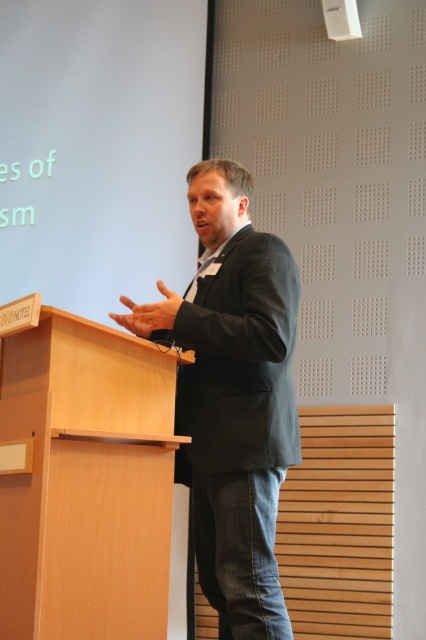
You are standing at the back of the room and want to approach the light wood podium at left to ask a question. If your walking speed is 3 feet per second, how many seconds will it take you to reach the podium?

The light wood podium at left is 7.29 feet away from the camera. Since you are at the back of the room, the distance to the podium would be approximately 7.29 feet. At a walking speed of 3 feet per second, it would take about 2.43 seconds to reach the podium.

You are an event planner setting up a stage for a presentation. You need to ensure that the microphone on the light wood podium at left is accessible to the speaker wearing the dark gray suit at center. Based on their heights, will the speaker be able to speak into the microphone comfortably?

The light wood podium at left is not as tall as the dark gray suit at center, which implies the podium is shorter than the speaker. This could make it difficult for the speaker to reach down to the microphone comfortably. Adjust the podium height or have the speaker step closer for better access.

You are an event planner setting up a stage for a presentation. You need to ensure that the light wood podium at left is positioned so that it is not blocking the dark gray suit at center from being seen by the audience. Based on their current positions, is the podium currently blocking the view of the suit?

The light wood podium at left is below the dark gray suit at center, so it is positioned lower and would not block the view of the dark gray suit at center from the audience.